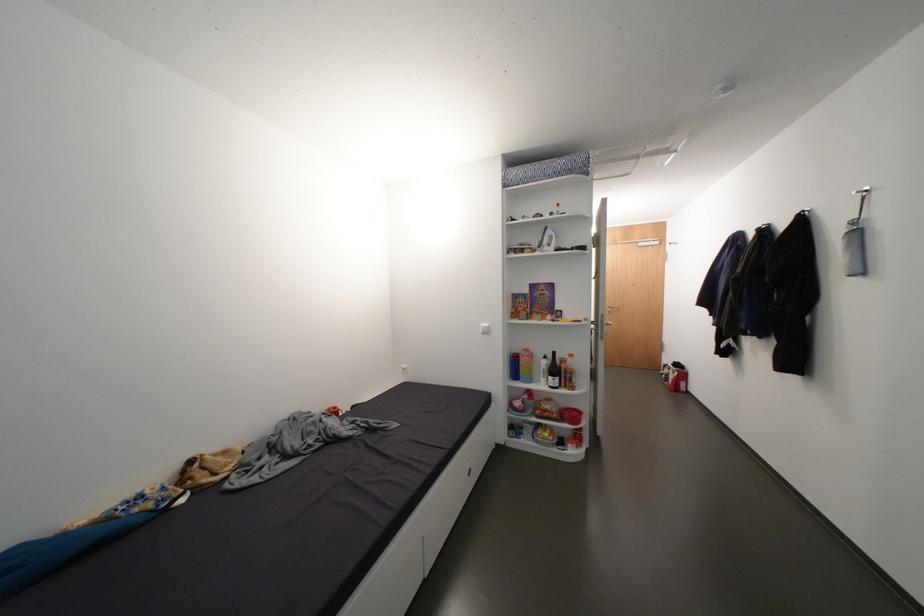
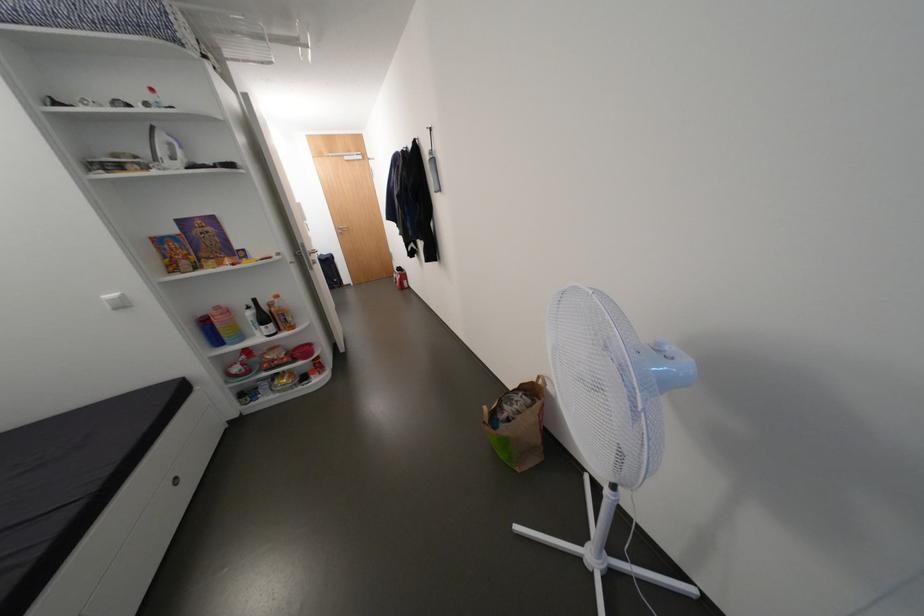
First-person continuous shooting, in which direction is the camera rotating?

The camera's rotation is toward right-down.